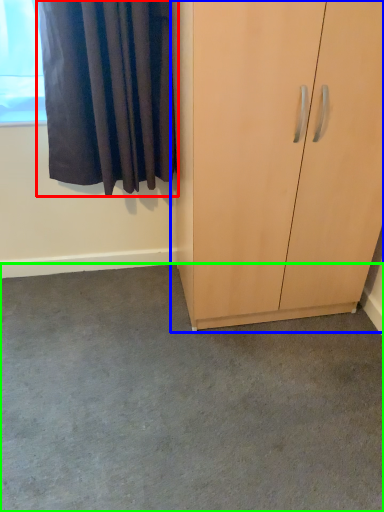
Question: Estimate the real-world distances between objects in this image. Which object is farther from curtain (highlighted by a red box), cupboard (highlighted by a blue box) or concrete (highlighted by a green box)?

Choices:
 (A) cupboard
 (B) concrete

Answer: (B)